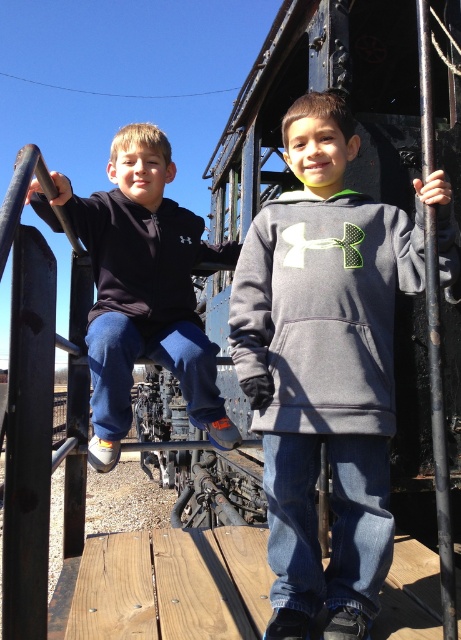
Which is behind, point (451, 260) or point (169, 253)?

Positioned behind is point (169, 253).

Is point (335, 365) farther from camera compared to point (226, 259)?

No, it is in front of (226, 259).

Identify the location of gray fleece sweatshirt at center. (324, 308).

Based on the photo, which is more to the left, matte black hoodie at left or black matte sweatshirt at left?

Positioned to the left is matte black hoodie at left.

What do you see at coordinates (145, 291) in the screenshot? This screenshot has height=640, width=461. I see `matte black hoodie at left` at bounding box center [145, 291].

The height and width of the screenshot is (640, 461). What are the coordinates of `matte black hoodie at left` in the screenshot? It's located at (145, 291).

Who is taller, gray fleece sweatshirt at center or matte black hoodie at left?

matte black hoodie at left is taller.

Does gray fleece sweatshirt at center appear under matte black hoodie at left?

Yes, gray fleece sweatshirt at center is below matte black hoodie at left.

Find the location of a particular element. This screenshot has width=461, height=640. gray fleece sweatshirt at center is located at coordinates (324, 308).